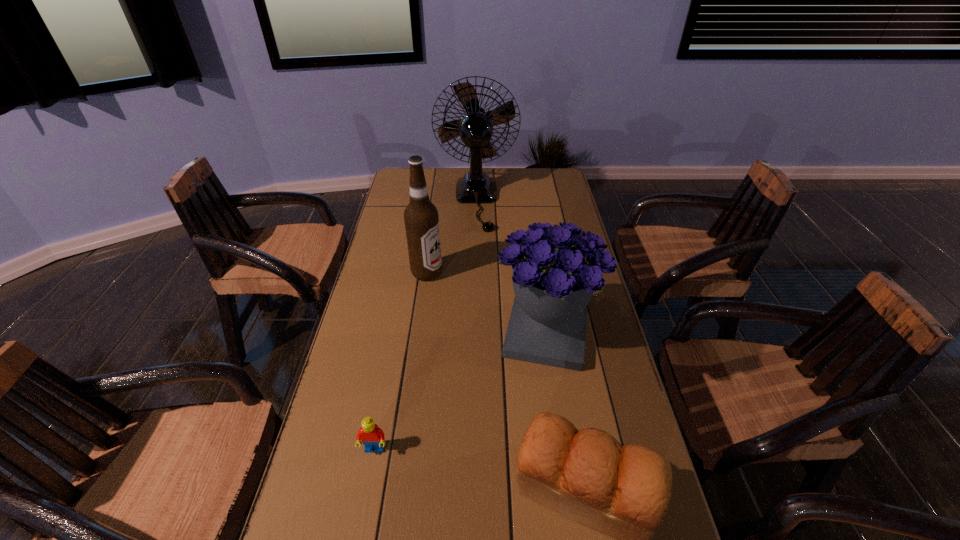
You are a GUI agent. You are given a task and a screenshot of the screen. Output one action in this format:
    pyautogui.click(x=<x>, y=<y>)
    Task: Click on the fan
    
    Given the screenshot: What is the action you would take?
    pyautogui.click(x=475, y=129)

Where is `alcohol`? The width and height of the screenshot is (960, 540). alcohol is located at coordinates (421, 219).

Find the location of a particular element. The image size is (960, 540). the third shortest object is located at coordinates (556, 269).

Where is `the third nearest object`? the third nearest object is located at coordinates (556, 269).

Find the location of a particular element. Lego is located at coordinates tap(372, 437).

Where is `vacant space located in front of the farthest object, indicating the direction of air flow`? The height and width of the screenshot is (540, 960). vacant space located in front of the farthest object, indicating the direction of air flow is located at coordinates (475, 307).

Locate an element on the screen. The height and width of the screenshot is (540, 960). free space located on the label of the second farthest object is located at coordinates (475, 273).

Where is `vacant area located on the front of the bouquet`? The height and width of the screenshot is (540, 960). vacant area located on the front of the bouquet is located at coordinates tap(564, 458).

Where is `free location located 0.100m on the face of the Lego`? This screenshot has width=960, height=540. free location located 0.100m on the face of the Lego is located at coordinates (364, 504).

Identify the location of object at the far edge. (475, 129).